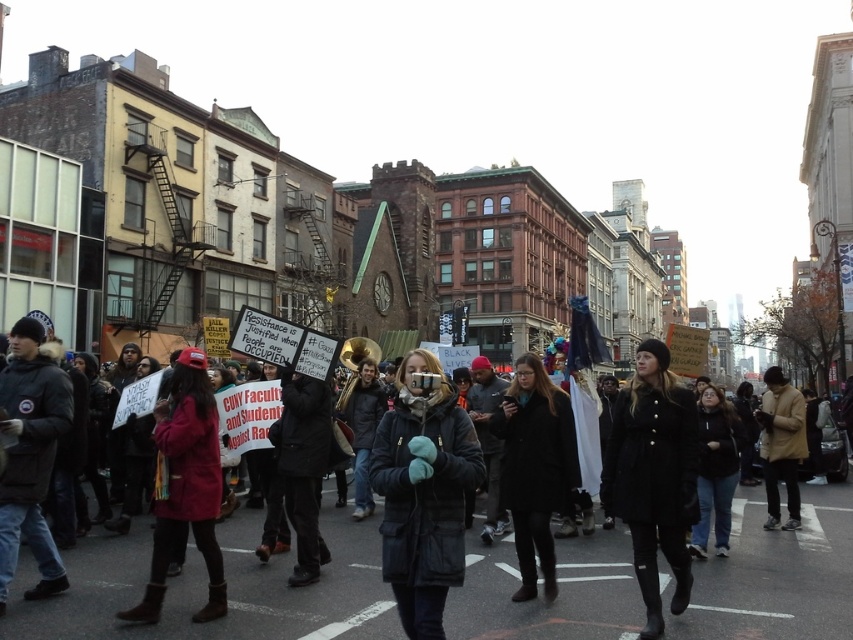
You are a photographer trying to capture a photo of the protest. You see the black wool coat at center and the tan leather jacket at right. Which one is more to the left?

The black wool coat at center is more to the left than the tan leather jacket at right.

You are a drone operator trying to capture aerial footage of the protest. Your drone is currently at a point located at coordinate point (x=656, y=388). You need to ascend to an altitude of 50 meters to get a better view. Is your current altitude sufficient to capture the entire protest scene?

The distance of point (x=656, y=388) from the viewer is 37.87 meters. Since the required altitude is 50 meters, the current altitude is insufficient to capture the entire protest scene.

Based on the scene description, which object, the black wool coat at center or the tan leather jacket at right, is positioned higher in the image?

The black wool coat at center is taller than the tan leather jacket at right, so the black wool coat at center is positioned higher in the image.